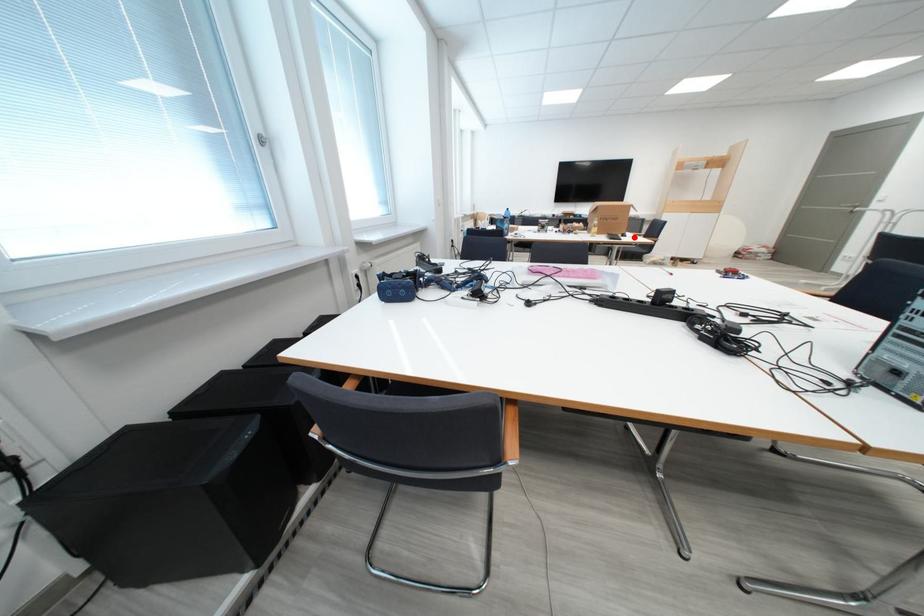
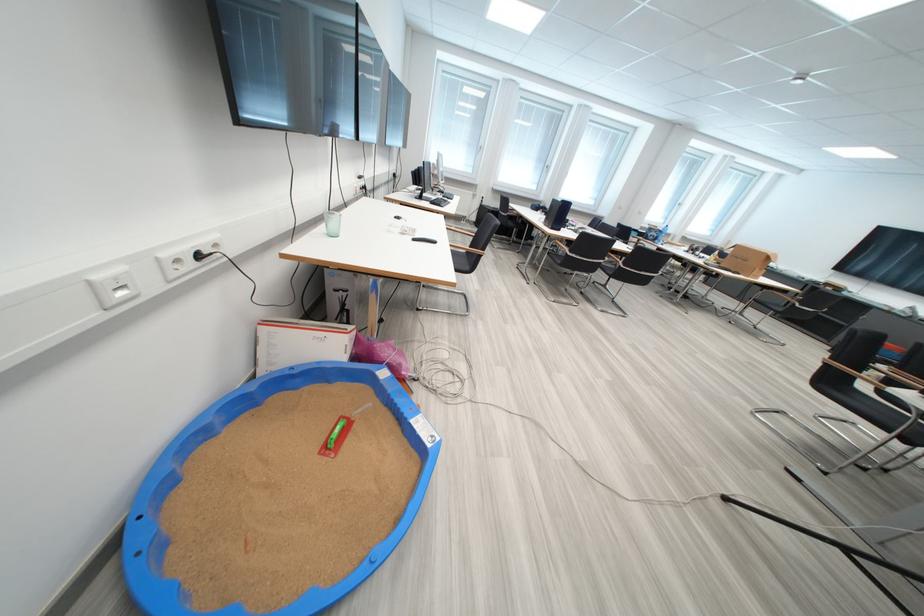
Question: I am providing you with two images of the same scene from different viewpoints. A red point is shown in image1. For the corresponding object point in image2, is it positioned nearer or farther from the camera?

Choices:
 (A) Nearer
 (B) Farther

Answer: (B)